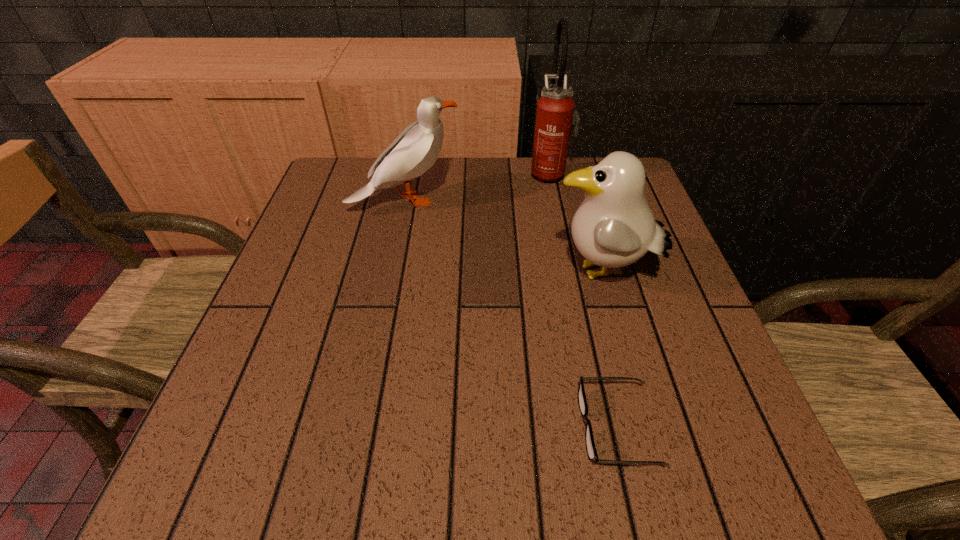
Where is `empty location between the right gull and the left gull`? The width and height of the screenshot is (960, 540). empty location between the right gull and the left gull is located at coordinates (503, 237).

Identify the location of vacant area between the left gull and the nearer gull. (503, 237).

This screenshot has width=960, height=540. I want to click on free point between the left gull and the tallest object, so click(x=477, y=187).

At what (x,y) coordinates should I click in order to perform the action: click on vacant space in between the fire extinguisher and the farther gull. Please return your answer as a coordinate pair (x, y). Image resolution: width=960 pixels, height=540 pixels. Looking at the image, I should click on (477, 187).

Where is `free space between the leftmost object and the tallest object`? The height and width of the screenshot is (540, 960). free space between the leftmost object and the tallest object is located at coordinates (477, 187).

Where is `empty location between the third farthest object and the nearest object`? Image resolution: width=960 pixels, height=540 pixels. empty location between the third farthest object and the nearest object is located at coordinates click(610, 350).

Locate an element on the screen. This screenshot has width=960, height=540. unoccupied area between the tallest object and the spectacles is located at coordinates (583, 300).

Identify the location of vacant space that's between the shortest object and the right gull. This screenshot has width=960, height=540. (610, 350).

Identify the location of free space between the nearer gull and the left gull. (503, 237).

Find the location of `object that stands as the closest to the second nearest object`. object that stands as the closest to the second nearest object is located at coordinates (592, 454).